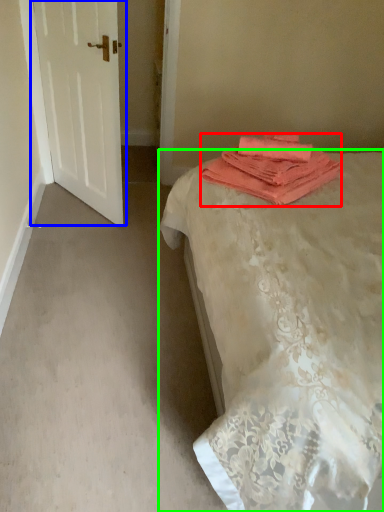
Question: Based on their relative distances, which object is farther from towel (highlighted by a red box)? Choose from door (highlighted by a blue box) and bed (highlighted by a green box).

Choices:
 (A) door
 (B) bed

Answer: (A)